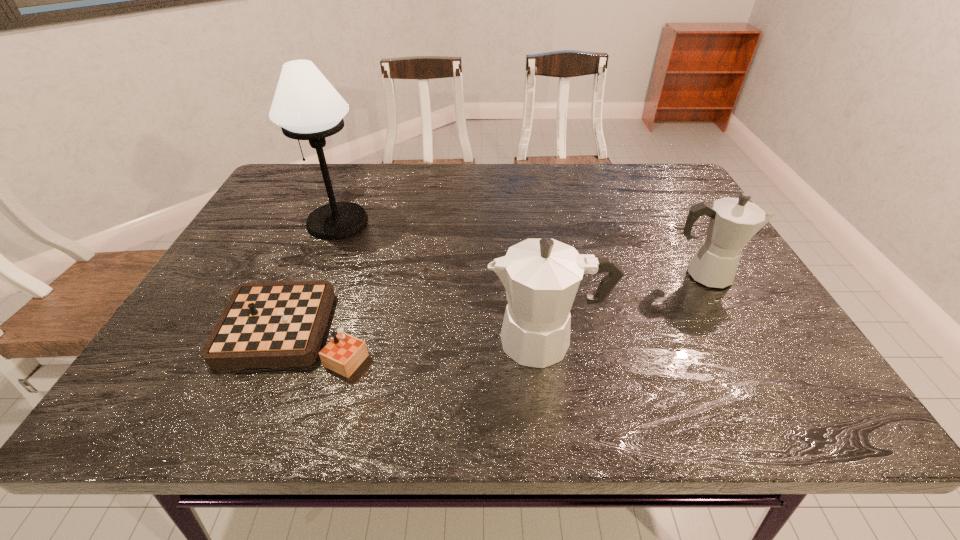
The image size is (960, 540). I want to click on vacant position located 0.210m at the spout of the nearer coffeepot, so click(x=385, y=341).

Locate an element on the screen. vacant region located 0.390m on the left of the shorter coffeepot is located at coordinates (508, 275).

Identify the location of free location located 0.070m on the back of the shortest object. (323, 272).

Identify the location of object located in the near edge section of the desktop. This screenshot has width=960, height=540. (270, 324).

This screenshot has width=960, height=540. Identify the location of table lamp present at the left edge. (307, 107).

You are a GUI agent. You are given a task and a screenshot of the screen. Output one action in this format:
    pyautogui.click(x=<x>, y=<y>)
    Task: Click on the chessboard present at the left edge
    
    Given the screenshot: What is the action you would take?
    pyautogui.click(x=270, y=324)

Locate an element on the screen. Image resolution: width=960 pixels, height=540 pixels. object that is positioned at the right edge is located at coordinates (733, 222).

This screenshot has width=960, height=540. I want to click on object that is at the near left corner, so click(x=270, y=324).

Image resolution: width=960 pixels, height=540 pixels. I want to click on vacant space at the far edge of the desktop, so click(x=541, y=171).

Identify the location of vacant area at the near edge of the desktop. (565, 408).